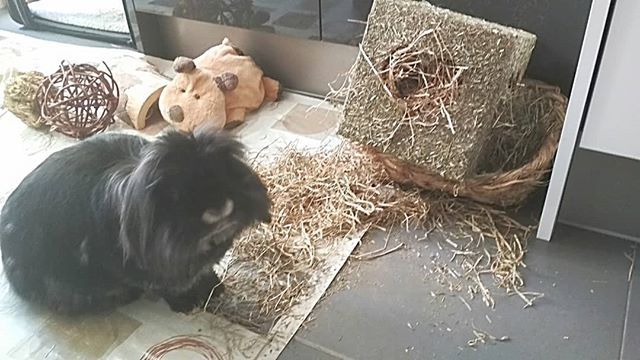
Image resolution: width=640 pixels, height=360 pixels. Find the location of `glass surface`. glass surface is located at coordinates (208, 6), (307, 9), (339, 11), (537, 12), (553, 30).